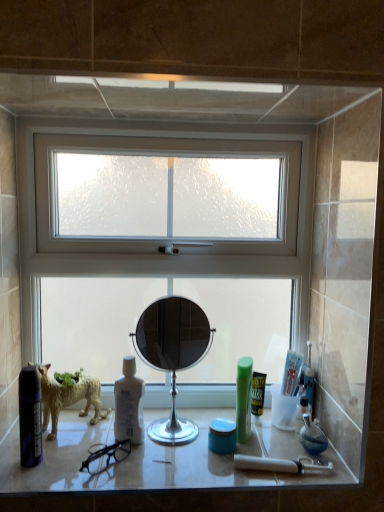
Where is `vacant space that's between white glossy mouthwash at center, the 1th mouthwash viewed from the left, and blue matte jar at center, the second mouthwash positioned from the left`? vacant space that's between white glossy mouthwash at center, the 1th mouthwash viewed from the left, and blue matte jar at center, the second mouthwash positioned from the left is located at coordinates (182, 445).